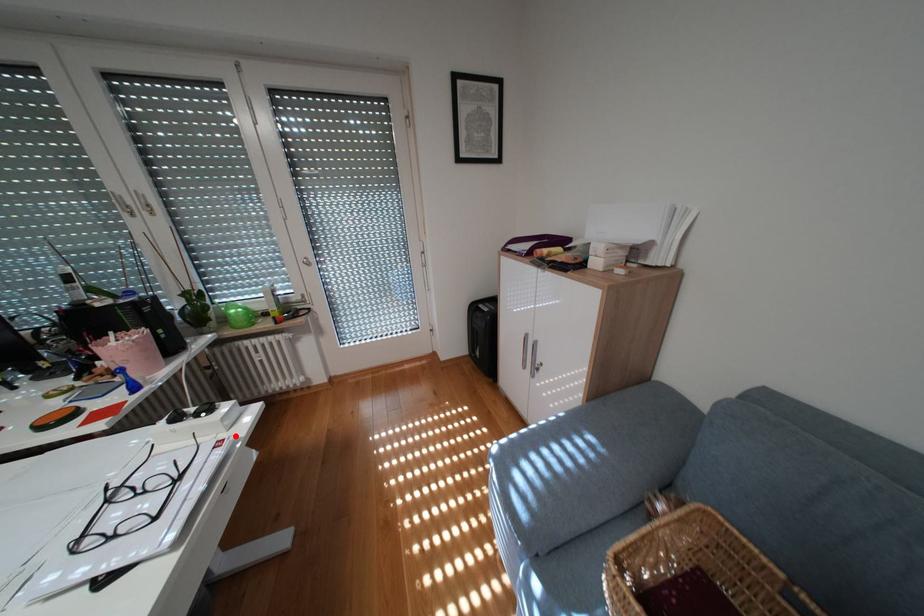
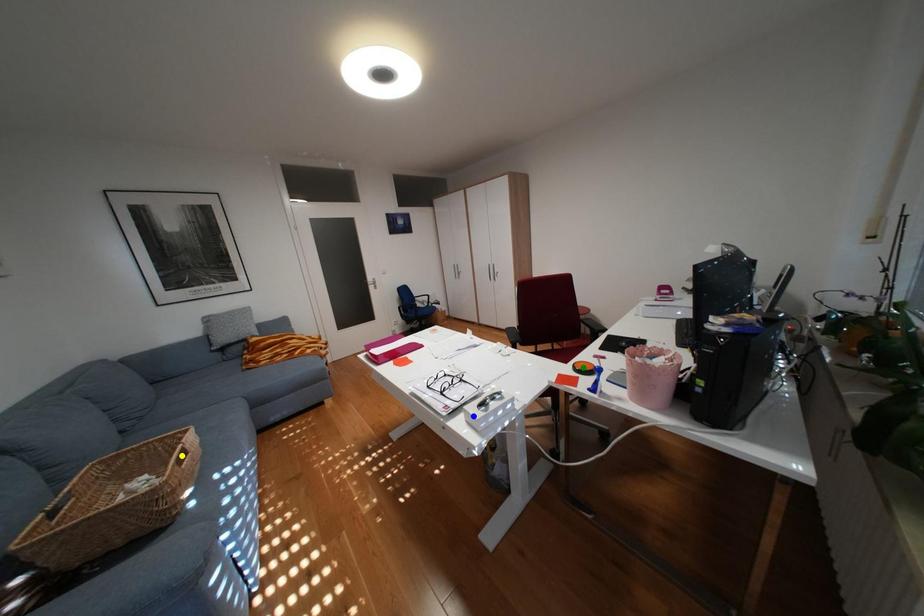
Question: I am providing you with two images of the same scene from different viewpoints. A red point is marked on the first image. You are given multiple points on the second image. Can you choose the point in image 2 that corresponds to the point in image 1?

Choices:
 (A) blue point
 (B) green point
 (C) yellow point

Answer: (A)